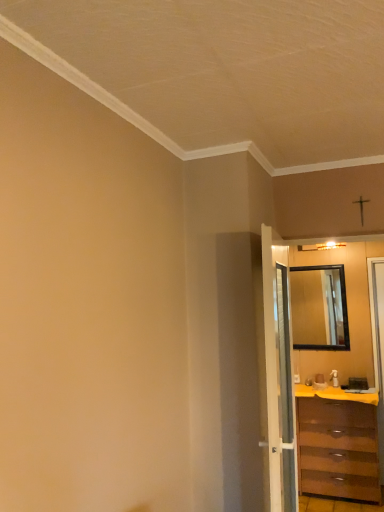
The image size is (384, 512). Describe the element at coordinates (319, 308) in the screenshot. I see `black glass mirror at right` at that location.

Describe the element at coordinates (335, 394) in the screenshot. The width and height of the screenshot is (384, 512). I see `yellow matte counter top at lower right` at that location.

Locate an element on the screen. The width and height of the screenshot is (384, 512). brown wooden chest of drawers at right is located at coordinates (337, 449).

How many degrees apart are the facing directions of white glossy door at center and brown wooden chest of drawers at right?

94.1 degrees separate the facing orientations of white glossy door at center and brown wooden chest of drawers at right.

Based on their positions, is white glossy door at center located to the left or right of brown wooden chest of drawers at right?

In the image, white glossy door at center appears on the left side of brown wooden chest of drawers at right.

Is white glossy door at center positioned before brown wooden chest of drawers at right?

Yes, it is.

Is brown wooden chest of drawers at right a part of white glossy door at center?

No, brown wooden chest of drawers at right is located outside of white glossy door at center.

Measure the distance from brown wooden chest of drawers at right to white glossy door at center.

4.41 feet.

Considering the sizes of objects brown wooden chest of drawers at right and white glossy door at center in the image provided, who is shorter, brown wooden chest of drawers at right or white glossy door at center?

brown wooden chest of drawers at right.

Which is further, (314, 429) or (280, 455)?

The point (314, 429) is farther.

From the image's perspective, is brown wooden chest of drawers at right below white glossy door at center?

Indeed, from the image's perspective, brown wooden chest of drawers at right is shown beneath white glossy door at center.

Does point (291, 411) lie behind point (374, 401)?

No.

From a real-world perspective, which is physically above, white glossy door at center or yellow matte counter top at lower right?

From a 3D spatial view, white glossy door at center is above.

From the image's perspective, is white glossy door at center positioned above or below yellow matte counter top at lower right?

Based on their image positions, white glossy door at center is located above yellow matte counter top at lower right.

The image size is (384, 512). I want to click on counter top that is under the white glossy door at center (from a real-world perspective), so click(335, 394).

From the picture: How many degrees apart are the facing directions of brown wooden chest of drawers at right and yellow matte counter top at lower right?

brown wooden chest of drawers at right and yellow matte counter top at lower right are facing 0.0296 degrees away from each other.

Considering the points (333, 425) and (340, 398), which point is in front, point (333, 425) or point (340, 398)?

The point (340, 398) is more forward.

Who is bigger, brown wooden chest of drawers at right or yellow matte counter top at lower right?

Bigger between the two is brown wooden chest of drawers at right.

In the scene shown: Which of these two, white glossy door at center or black glass mirror at right, is bigger?

Bigger between the two is white glossy door at center.

You are a GUI agent. You are given a task and a screenshot of the screen. Output one action in this format:
    pyautogui.click(x=<x>, y=<y>)
    Task: Click on the door in front of the black glass mirror at right
    
    Given the screenshot: What is the action you would take?
    pyautogui.click(x=279, y=380)

From a real-world perspective, is white glossy door at center over black glass mirror at right?

No.

Is the depth of black glass mirror at right less than that of yellow matte counter top at lower right?

No, it is not.

From the image's perspective, which is above, black glass mirror at right or yellow matte counter top at lower right?

From the image's view, black glass mirror at right is above.

Consider the image. Is black glass mirror at right thinner than yellow matte counter top at lower right?

Indeed, black glass mirror at right has a lesser width compared to yellow matte counter top at lower right.

Which is less distant, (x=312, y=318) or (x=307, y=396)?

The point (x=307, y=396) is more forward.

Measure the distance from brown wooden chest of drawers at right to black glass mirror at right.

They are 33.01 inches apart.

Is black glass mirror at right at the back of brown wooden chest of drawers at right?

No, brown wooden chest of drawers at right is not facing the opposite direction of black glass mirror at right.

Can you tell me how much brown wooden chest of drawers at right and black glass mirror at right differ in facing direction?

There is a 0.324-degree angle between the facing directions of brown wooden chest of drawers at right and black glass mirror at right.

Does brown wooden chest of drawers at right appear on the left side of black glass mirror at right?

Yes.

This screenshot has width=384, height=512. I want to click on chest of drawers below the white glossy door at center (from the image's perspective), so click(x=337, y=449).

The height and width of the screenshot is (512, 384). I want to click on the chest of drawers behind the white glossy door at center, so click(x=337, y=449).

Looking at the image, which one is located further to white glossy door at center, black glass mirror at right or brown wooden chest of drawers at right?

black glass mirror at right.

Looking at the image, which one is located further to white glossy door at center, brown wooden chest of drawers at right or black glass mirror at right?

black glass mirror at right is positioned further to the anchor white glossy door at center.

Looking at the image, which one is located further to brown wooden chest of drawers at right, white glossy door at center or black glass mirror at right?

white glossy door at center is positioned further to the anchor brown wooden chest of drawers at right.

Considering their positions, is black glass mirror at right positioned closer to yellow matte counter top at lower right than white glossy door at center?

black glass mirror at right is positioned closer to the anchor yellow matte counter top at lower right.

When comparing their distances from brown wooden chest of drawers at right, does black glass mirror at right or yellow matte counter top at lower right seem closer?

yellow matte counter top at lower right.

Estimate the real-world distances between objects in this image. Which object is further from yellow matte counter top at lower right, black glass mirror at right or brown wooden chest of drawers at right?

Based on the image, black glass mirror at right appears to be further to yellow matte counter top at lower right.

Which object lies further to the anchor point black glass mirror at right, yellow matte counter top at lower right or white glossy door at center?

Among the two, white glossy door at center is located further to black glass mirror at right.

Consider the image. From the image, which object appears to be nearer to black glass mirror at right, white glossy door at center or brown wooden chest of drawers at right?

Among the two, brown wooden chest of drawers at right is located nearer to black glass mirror at right.

The height and width of the screenshot is (512, 384). I want to click on counter top between white glossy door at center and black glass mirror at right from front to back, so click(x=335, y=394).

Identify the location of chest of drawers between white glossy door at center and yellow matte counter top at lower right along the z-axis. (337, 449).

At what (x,y) coordinates should I click in order to perform the action: click on counter top between black glass mirror at right and brown wooden chest of drawers at right in the up-down direction. Please return your answer as a coordinate pair (x, y). This screenshot has width=384, height=512. Looking at the image, I should click on (335, 394).

The width and height of the screenshot is (384, 512). I want to click on the chest of drawers located between white glossy door at center and black glass mirror at right in the depth direction, so click(x=337, y=449).